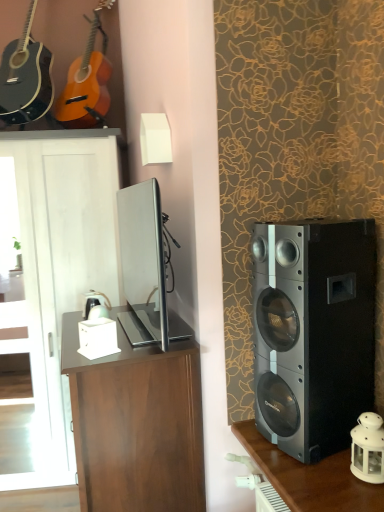
Question: Is dark wood shelf at right taller than satin silver tv at center?

Choices:
 (A) no
 (B) yes

Answer: (A)

Question: Considering the relative sizes of dark wood shelf at right and satin silver tv at center in the image provided, is dark wood shelf at right bigger than satin silver tv at center?

Choices:
 (A) no
 (B) yes

Answer: (A)

Question: From the image's perspective, is dark wood shelf at right over satin silver tv at center?

Choices:
 (A) no
 (B) yes

Answer: (A)

Question: Would you say dark wood shelf at right is a long distance from satin silver tv at center?

Choices:
 (A) no
 (B) yes

Answer: (B)

Question: Is dark wood shelf at right facing towards satin silver tv at center?

Choices:
 (A) no
 (B) yes

Answer: (A)

Question: Choose the correct answer: Is white glass lantern at lower right inside brown wood cabinet at left or outside it?

Choices:
 (A) outside
 (B) inside

Answer: (A)

Question: From a real-world perspective, is white glass lantern at lower right positioned above or below brown wood cabinet at left?

Choices:
 (A) above
 (B) below

Answer: (B)

Question: Is point (377, 456) positioned closer to the camera than point (115, 181)?

Choices:
 (A) closer
 (B) farther

Answer: (A)

Question: Considering their positions, is white glass lantern at lower right located in front of or behind brown wood cabinet at left?

Choices:
 (A) front
 (B) behind

Answer: (A)

Question: Considering the positions of point (92, 26) and point (286, 336), is point (92, 26) closer or farther from the camera than point (286, 336)?

Choices:
 (A) farther
 (B) closer

Answer: (A)

Question: Considering the positions of matte wood guitar at upper left, arranged as the first guitar when viewed from the right, and black metallic speaker at right in the image, is matte wood guitar at upper left, arranged as the first guitar when viewed from the right, taller or shorter than black metallic speaker at right?

Choices:
 (A) tall
 (B) short

Answer: (A)

Question: From the image's perspective, relative to black metallic speaker at right, is matte wood guitar at upper left, which appears as the 2th guitar when viewed from the left, above or below?

Choices:
 (A) above
 (B) below

Answer: (A)

Question: Based on their positions, is matte wood guitar at upper left, which appears as the 2th guitar when viewed from the left, located to the left or right of black metallic speaker at right?

Choices:
 (A) right
 (B) left

Answer: (B)

Question: Looking at the image, does black metallic speaker at right seem bigger or smaller compared to brown wood desk at center?

Choices:
 (A) big
 (B) small

Answer: (B)

Question: Looking at their shapes, would you say black metallic speaker at right is wider or thinner than brown wood desk at center?

Choices:
 (A) thin
 (B) wide

Answer: (A)